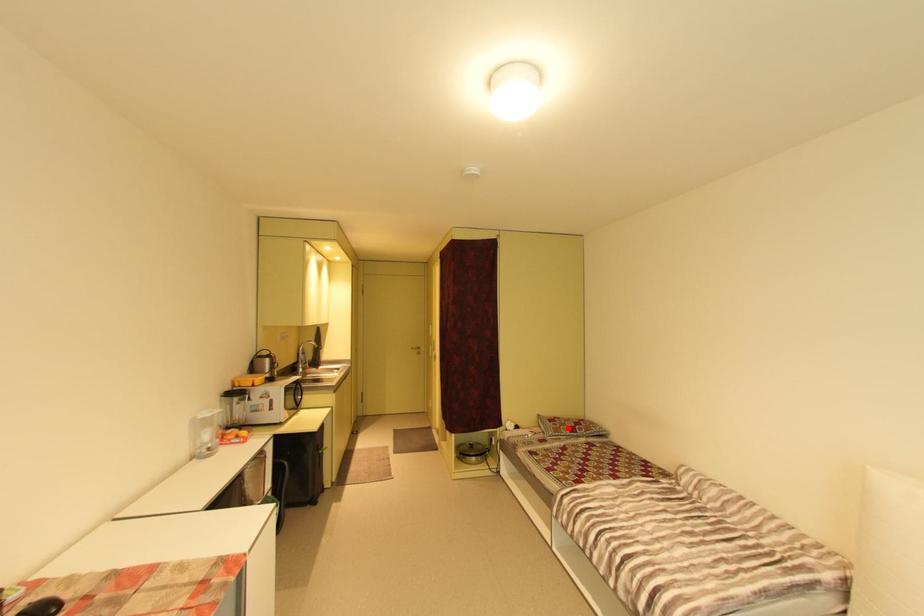
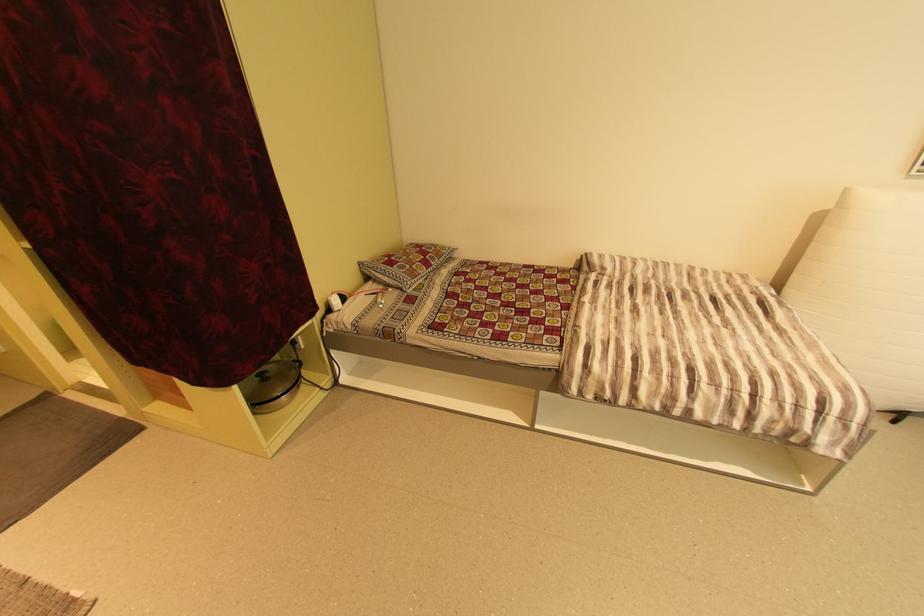
Find the pixel in the second image that matches the highlighted location in the first image.

(420, 267)